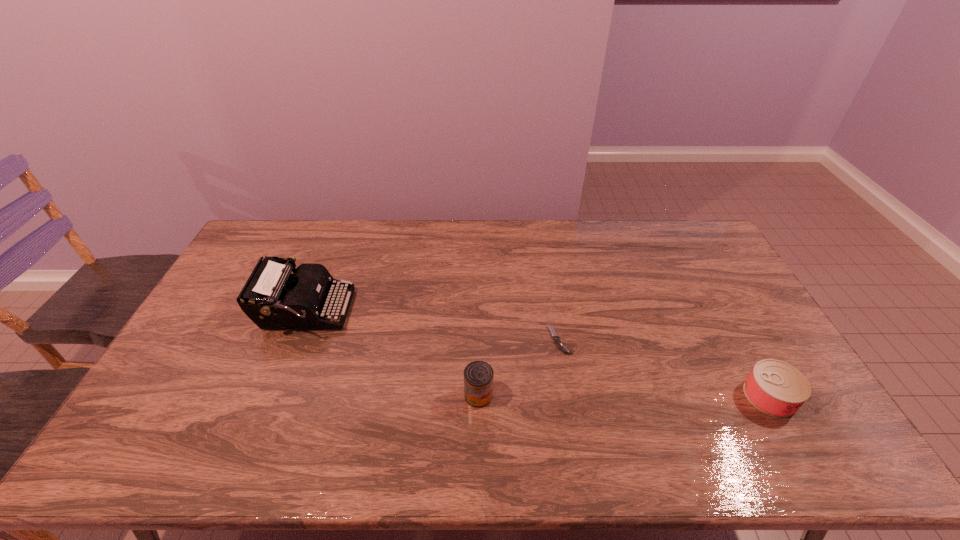
Locate an element on the screen. The width and height of the screenshot is (960, 540). free point between the tallest object and the rightmost object is located at coordinates (538, 353).

I want to click on vacant space that is in between the right can and the tallest object, so [538, 353].

Identify the location of free space between the tallest object and the second shortest object. (538, 353).

At what (x,y) coordinates should I click in order to perform the action: click on vacant space that's between the second object from left to right and the shorter can. Please return your answer as a coordinate pair (x, y). The height and width of the screenshot is (540, 960). Looking at the image, I should click on (624, 396).

You are a GUI agent. You are given a task and a screenshot of the screen. Output one action in this format:
    pyautogui.click(x=<x>, y=<y>)
    Task: Click on the free space that is in between the left can and the shortest object
    
    Given the screenshot: What is the action you would take?
    pyautogui.click(x=518, y=368)

Image resolution: width=960 pixels, height=540 pixels. In order to click on vacant space that's between the right can and the shortest object in this screenshot , I will do `click(664, 368)`.

Identify the location of vacant space that is in between the typewriter and the shorter can. The width and height of the screenshot is (960, 540). (538, 353).

Find the location of a particular element. The width and height of the screenshot is (960, 540). object that ranks as the second closest to the shortest object is located at coordinates 776,388.

You are a GUI agent. You are given a task and a screenshot of the screen. Output one action in this format:
    pyautogui.click(x=<x>, y=<y>)
    Task: Click on the object that is the third closest to the leftmost object
    
    Given the screenshot: What is the action you would take?
    pyautogui.click(x=776, y=388)

Locate an element on the screen. free space that satisfies the following two spatial constraints: 1. on the typing side of the pocketknife; 2. on the right side of the leftmost object is located at coordinates (294, 340).